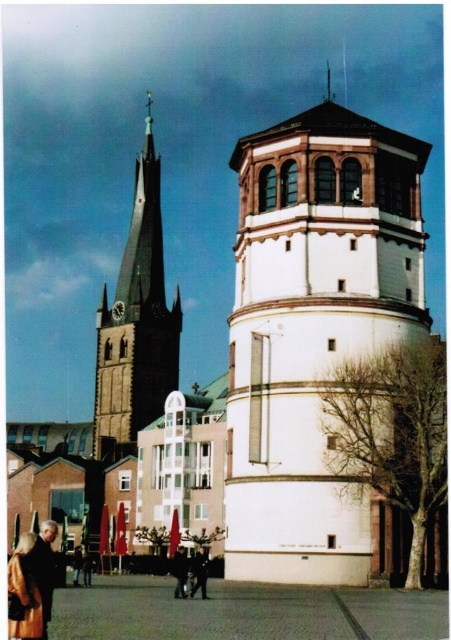
Measure the distance from dark gray stone tower at left to dark brown leather jacket at lower left.

dark gray stone tower at left is 53.57 meters away from dark brown leather jacket at lower left.

Find the location of `dark gray stone tower at left`. dark gray stone tower at left is located at coordinates (136, 323).

Can you confirm if dark gray stone tower at left is positioned below golden textured coat at lower left?

Actually, dark gray stone tower at left is above golden textured coat at lower left.

In the scene shown: Between dark gray stone tower at left and golden textured coat at lower left, which one has more height?

Standing taller between the two is dark gray stone tower at left.

Which is behind, point (124, 339) or point (28, 540)?

The point (124, 339) is more distant.

The image size is (451, 640). I want to click on dark gray stone tower at left, so 136,323.

Between golden textured coat at lower left and dark blue jeans at center, which one appears on the left side from the viewer's perspective?

golden textured coat at lower left is more to the left.

Locate an element on the screen. golden textured coat at lower left is located at coordinates (32, 582).

Identify the location of golden textured coat at lower left. Image resolution: width=451 pixels, height=640 pixels. (32, 582).